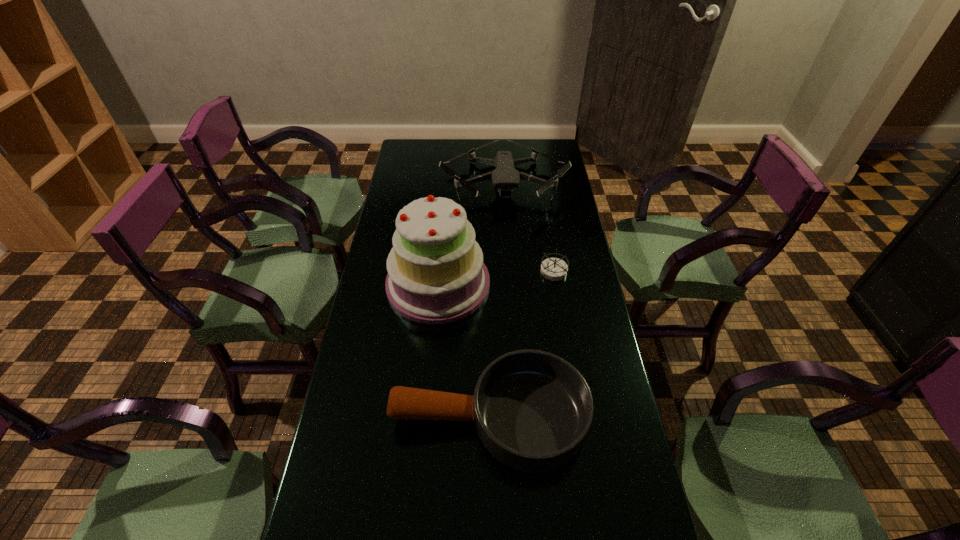
Image resolution: width=960 pixels, height=540 pixels. I want to click on the tallest object, so click(436, 275).

The image size is (960, 540). I want to click on the farthest object, so click(x=505, y=177).

Identify the location of the nearest object. This screenshot has width=960, height=540. (532, 410).

You are a GUI agent. You are given a task and a screenshot of the screen. Output one action in this format:
    pyautogui.click(x=<x>, y=<y>)
    Task: Click on the compass
    
    Given the screenshot: What is the action you would take?
    pyautogui.click(x=554, y=269)

Image resolution: width=960 pixels, height=540 pixels. In order to click on vacant point located on the right of the tallest object in this screenshot , I will do `click(543, 284)`.

You are a GUI agent. You are given a task and a screenshot of the screen. Output one action in this format:
    pyautogui.click(x=<x>, y=<y>)
    Task: Click on the vacant space situated on the front-facing side of the farthest object
    
    Given the screenshot: What is the action you would take?
    pyautogui.click(x=508, y=238)

Where is `free location located on the handle side of the pan`? free location located on the handle side of the pan is located at coordinates (353, 417).

Where is `free point located 0.120m on the left of the compass`? free point located 0.120m on the left of the compass is located at coordinates (506, 272).

Locate an element on the screen. The image size is (960, 540). object that is at the far edge is located at coordinates (505, 177).

You are a GUI agent. You are given a task and a screenshot of the screen. Output one action in this format:
    pyautogui.click(x=<x>, y=<y>)
    Task: Click on the cake situated at the left edge
    This screenshot has height=540, width=960.
    Given the screenshot: What is the action you would take?
    pyautogui.click(x=436, y=275)